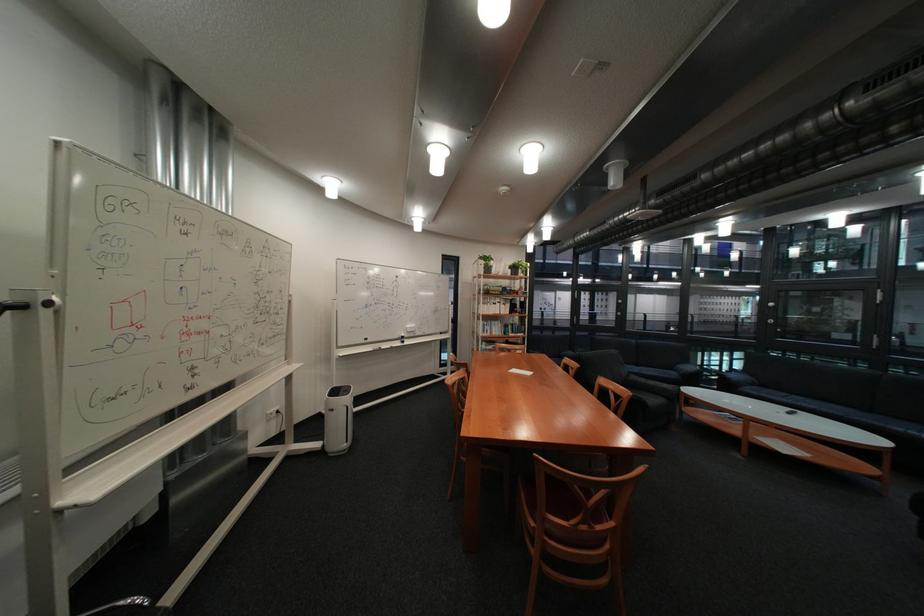
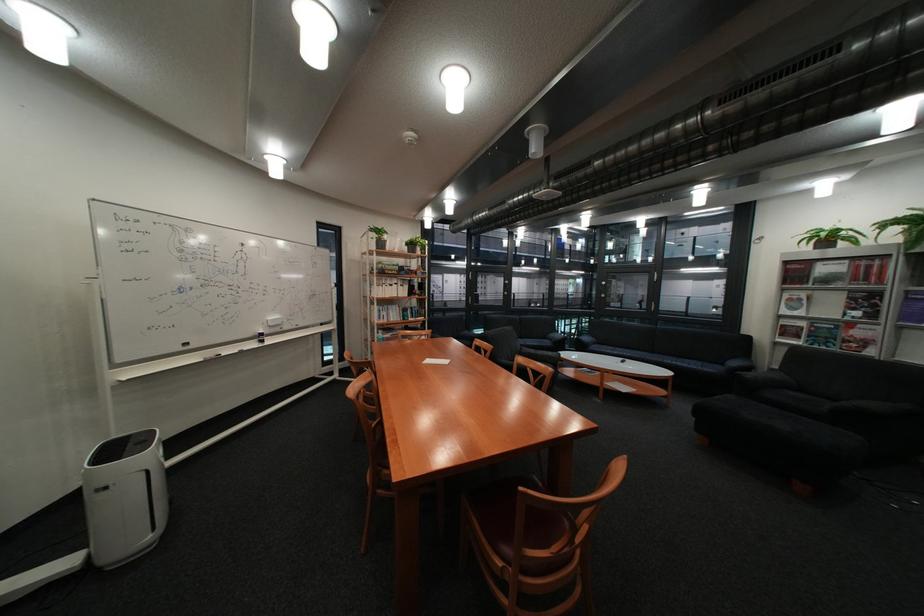
Question: The camera is either moving clockwise (left) or counter-clockwise (right) around the object. The first image is from the beginning of the video and the second image is from the end. Is the camera moving left or right when shooting the video?

Choices:
 (A) Left
 (B) Right

Answer: (A)